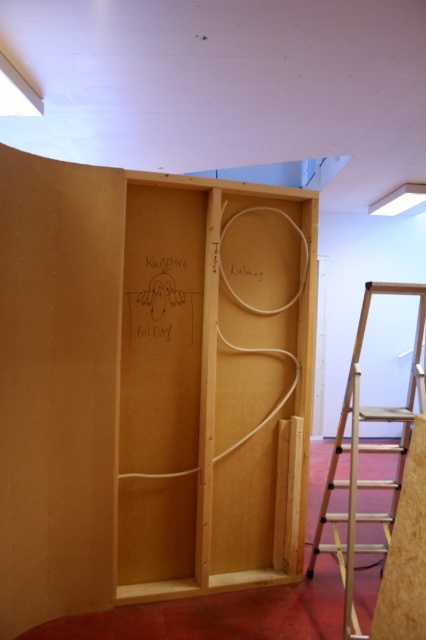
You are standing in the construction area and want to move from the point at coordinates (25, 392) to the point at coordinates (348, 548). Can you walk directly between these two points without any obstacles?

Point (25, 392) is behind point (348, 548), so you cannot walk directly between them as the first point is obscured from view by the second.

You are a contractor working on a construction site. You need to move the wooden step ladder at right to the storage area. However, you also need to keep the natural wood plywood at center in place for the current project. Which object should you move first to ensure the plywood stays undisturbed?

You should move the wooden step ladder at right first because it is smaller than the natural wood plywood at center, so moving it won t interfere with the plywood.

Looking at this image, you are an interior designer planning to place the natural wood plywood at center and the wooden step ladder at right in the construction area. Which object has a greater width?

The natural wood plywood at center has a greater width than the wooden step ladder at right.